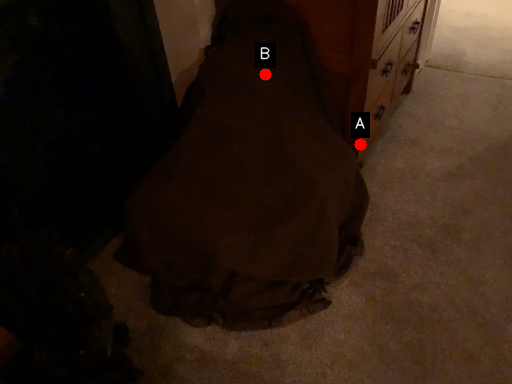
Question: Two points are circled on the image, labeled by A and B beside each circle. Which of the following is the farthest from the observer?

Choices:
 (A) A is further
 (B) B is further

Answer: (A)